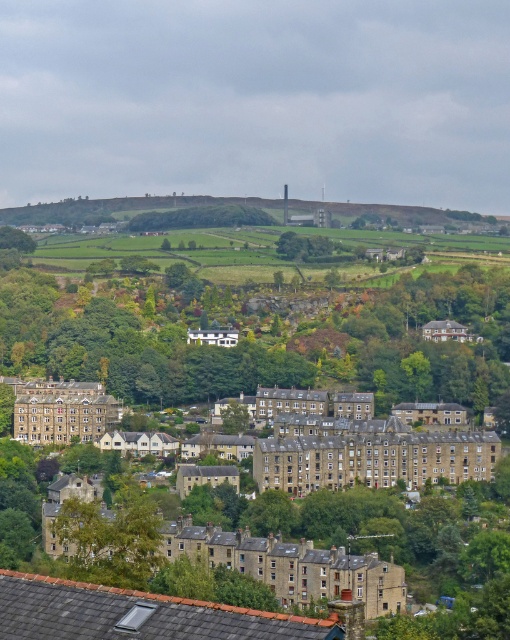
Question: Which of the following is the farthest from the observer?

Choices:
 (A) (228, 220)
 (B) (91, 563)

Answer: (A)

Question: Is green leafy tree at lower left in front of green leafy tree at center?

Choices:
 (A) no
 (B) yes

Answer: (B)

Question: Does green leafy tree at lower left come in front of green leafy tree at center?

Choices:
 (A) no
 (B) yes

Answer: (B)

Question: In this image, where is green leafy tree at lower left located relative to green leafy tree at center?

Choices:
 (A) above
 (B) below

Answer: (B)